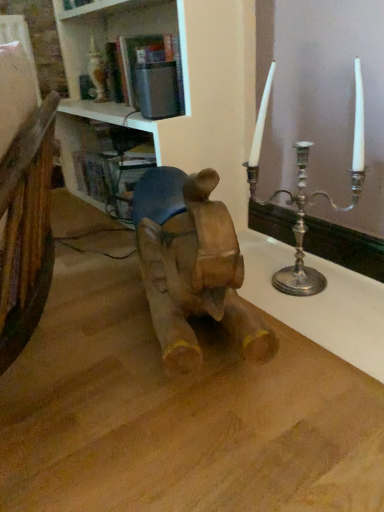
I want to click on free spot in front of wooden horse at center, so click(x=186, y=433).